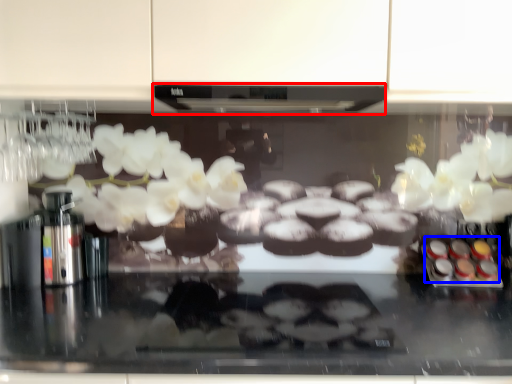
Question: Which point is further to the camera, exhaust hood (highlighted by a red box) or food (highlighted by a blue box)?

Choices:
 (A) exhaust hood
 (B) food

Answer: (B)